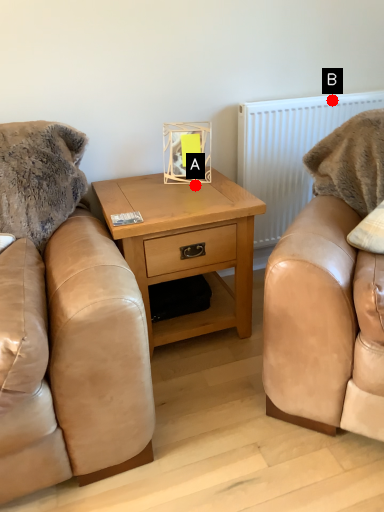
Question: Two points are circled on the image, labeled by A and B beside each circle. Which point is closer to the camera?

Choices:
 (A) A is closer
 (B) B is closer

Answer: (A)